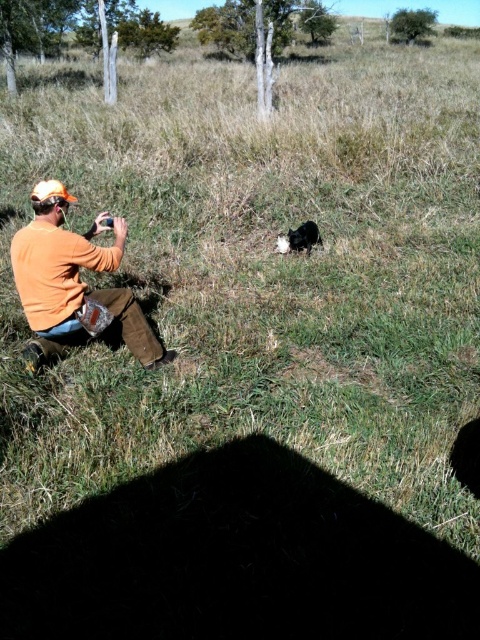
Question: Is orange cotton shirt at left wider than black fur dog at center?

Choices:
 (A) yes
 (B) no

Answer: (A)

Question: Does orange cotton shirt at left have a greater width compared to black fur dog at center?

Choices:
 (A) no
 (B) yes

Answer: (B)

Question: Is orange cotton shirt at left positioned behind black fur dog at center?

Choices:
 (A) no
 (B) yes

Answer: (A)

Question: Which point is farther to the camera?

Choices:
 (A) orange cotton shirt at left
 (B) black fur dog at center

Answer: (B)

Question: Which of the following is the closest to the observer?

Choices:
 (A) black fur dog at center
 (B) orange cotton shirt at left

Answer: (B)